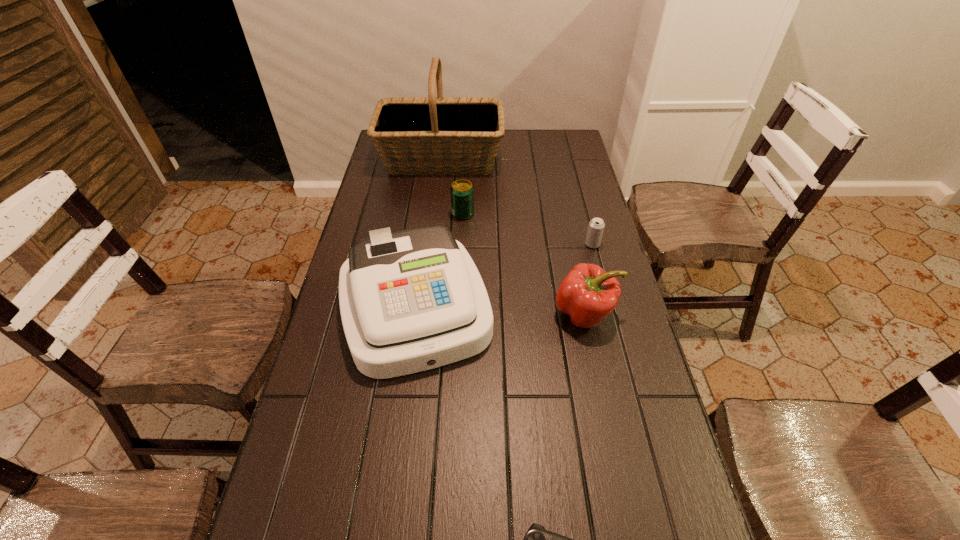
Locate an element on the screen. This screenshot has width=960, height=540. blank area at the left edge is located at coordinates (363, 202).

Locate an element on the screen. This screenshot has width=960, height=540. free region at the right edge of the desktop is located at coordinates (x=615, y=405).

In order to click on free area in between the fourth nearest object and the second farthest object in this screenshot , I will do `click(528, 229)`.

The width and height of the screenshot is (960, 540). I want to click on blank region between the third tallest object and the fifth shortest object, so click(x=500, y=311).

At what (x,y) coordinates should I click in order to perform the action: click on free space between the second tallest object and the pepper. Please return your answer as a coordinate pair (x, y). The image size is (960, 540). Looking at the image, I should click on tap(500, 311).

I want to click on free point between the fifth shortest object and the nearer beer can, so click(504, 276).

Find the location of a particular element. Image resolution: width=960 pixels, height=540 pixels. vacant point located between the nearer beer can and the left beer can is located at coordinates (528, 229).

Where is `object that can be found as the fifth closest to the pepper`? object that can be found as the fifth closest to the pepper is located at coordinates [431, 135].

Select which object is the closest to the fifth tallest object. Please provide its 2D coordinates. Your answer should be formatted as a tuple, i.e. [(x, y)], where the tuple contains the x and y coordinates of a point satisfying the conditions above.

[(587, 294)]

At what (x,y) coordinates should I click in order to perform the action: click on free space in the image that satisfies the following two spatial constraints: 1. by the handle of the third farthest object; 2. on the right side of the basket. Please return your answer as a coordinate pair (x, y). The height and width of the screenshot is (540, 960). Looking at the image, I should click on (431, 244).